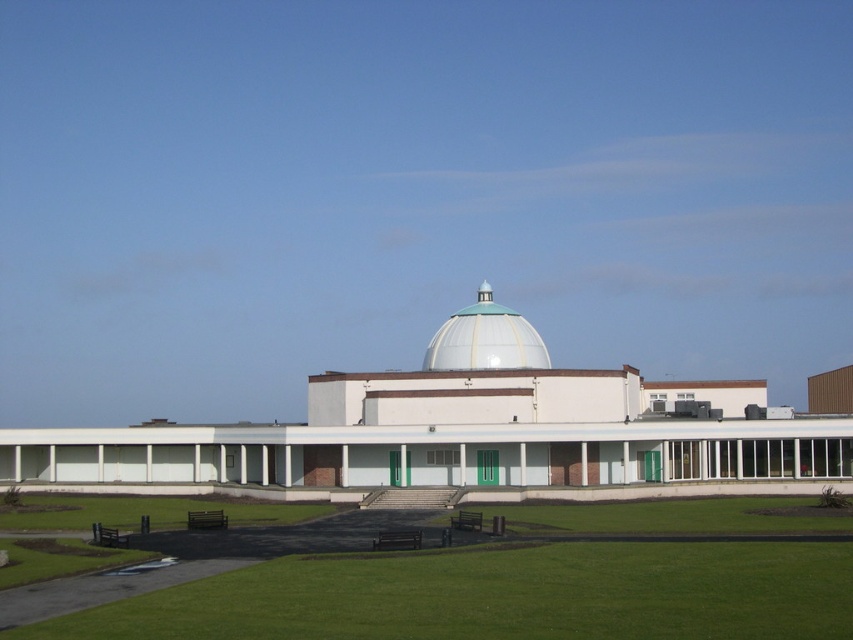
You are planning to set up a temporary stage for an event. The stage requires a flat area that is wider than the white glossy dome at center. Can the green grass at lower center accommodate the stage?

The green grass at lower center might be wider than the white glossy dome at center, so it could potentially accommodate the stage if the width requirement is met.